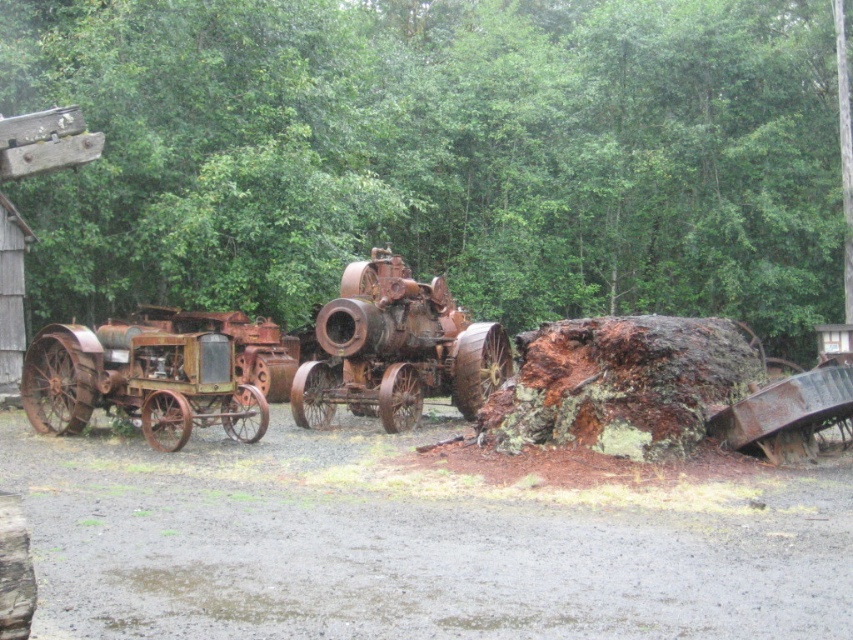
Is rusty metal tractor at center taller than rusty metal tractor at left?

No.

Is rusty metal tractor at center bigger than rusty metal tractor at left?

Actually, rusty metal tractor at center might be smaller than rusty metal tractor at left.

You are a GUI agent. You are given a task and a screenshot of the screen. Output one action in this format:
    pyautogui.click(x=<x>, y=<y>)
    Task: Click on the rusty metal tractor at center
    The image size is (853, 640).
    Given the screenshot: What is the action you would take?
    pyautogui.click(x=393, y=349)

Between green leafy tree at upper center and rusty metal tractor at center, which one appears on the left side from the viewer's perspective?

Positioned to the left is rusty metal tractor at center.

Does green leafy tree at upper center appear under rusty metal tractor at center?

No, green leafy tree at upper center is not below rusty metal tractor at center.

Does point (836, 90) lie in front of point (378, 282)?

That is False.

Where is `green leafy tree at upper center`? green leafy tree at upper center is located at coordinates (438, 156).

Can you confirm if green leafy tree at upper center is bigger than rusty metal tractor at left?

Indeed, green leafy tree at upper center has a larger size compared to rusty metal tractor at left.

Between point (149, 3) and point (142, 385), which one is positioned behind?

The point (149, 3) is behind.

Is point (351, 81) positioned behind point (126, 404)?

Yes.

The height and width of the screenshot is (640, 853). Identify the location of green leafy tree at upper center. (438, 156).